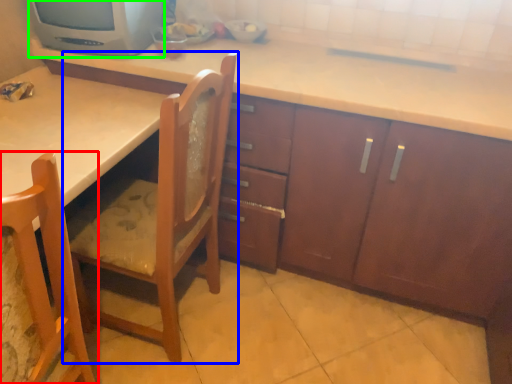
Question: Which object is the closest to the chair (highlighted by a red box)? Choose among these: chair (highlighted by a blue box) or home appliance (highlighted by a green box).

Choices:
 (A) chair
 (B) home appliance

Answer: (A)